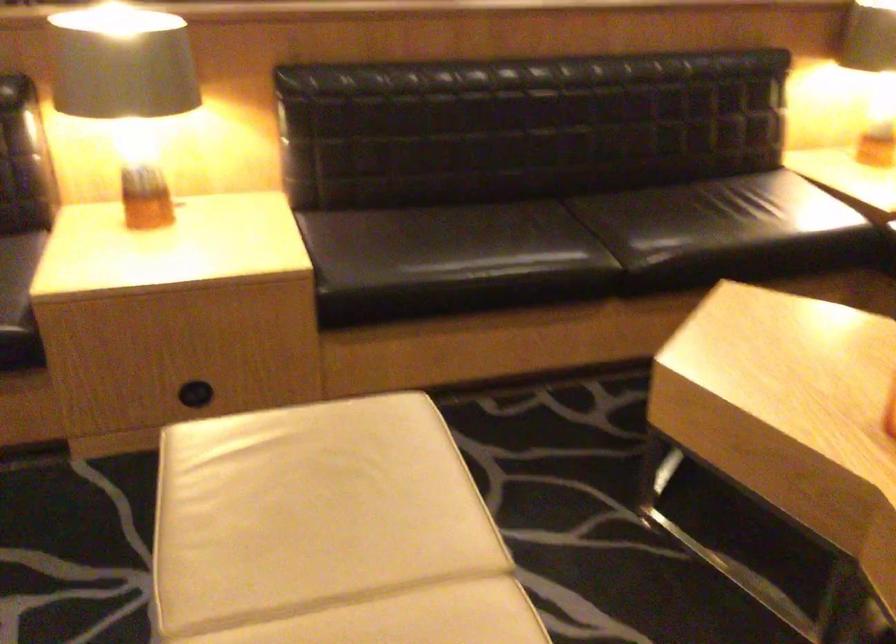
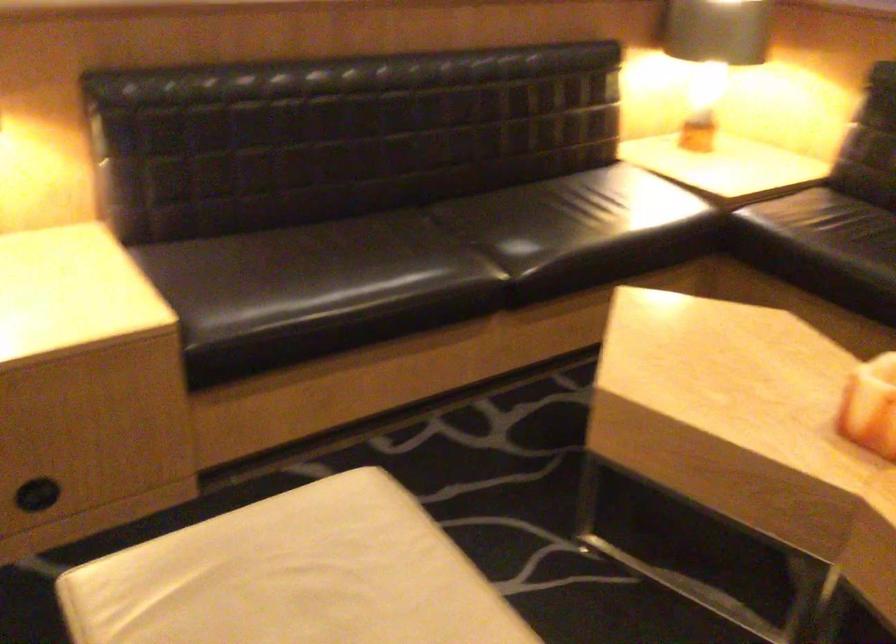
In a continuous first-person perspective shot, in which direction is the camera moving?

The cameraman moved toward left, forward.